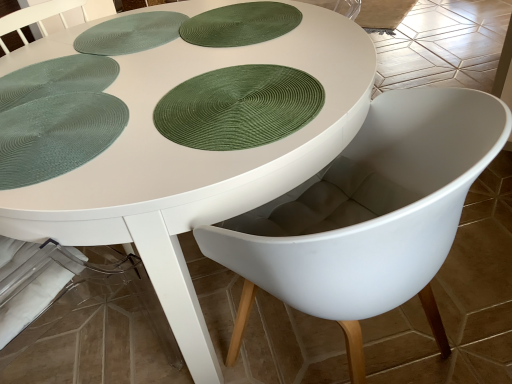
The image size is (512, 384). Identify the location of vacant space positioned to the left of green textured placemat at upper center, the 1th paper plate viewed from the top. (125, 51).